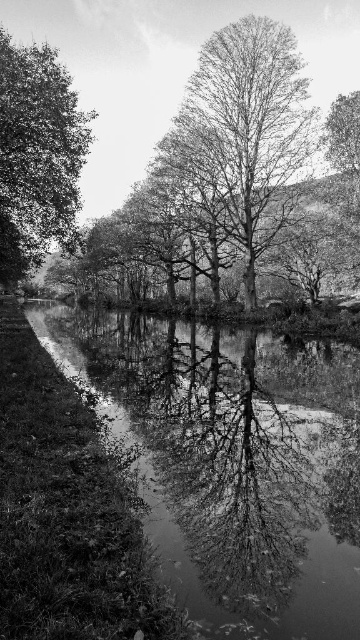
Describe the element at coordinates (243, 134) in the screenshot. This screenshot has width=360, height=640. I see `bare wood tree at center` at that location.

Is bare wood tree at center positioned behind dark green leafy tree at left?

Yes, it is behind dark green leafy tree at left.

Measure the distance between bare wood tree at center and camera.

They are 40.82 meters apart.

Image resolution: width=360 pixels, height=640 pixels. I want to click on bare wood tree at center, so click(243, 134).